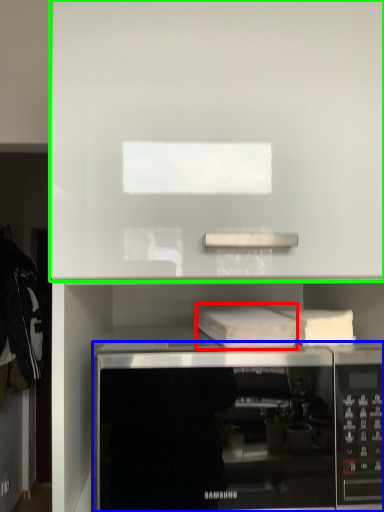
Question: Which object is positioned farthest from book (highlighted by a red box)? Select from microwave oven (highlighted by a blue box) and cabinet (highlighted by a green box).

Choices:
 (A) microwave oven
 (B) cabinet

Answer: (B)